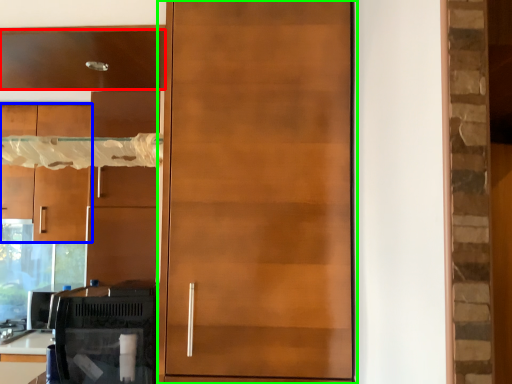
Question: Based on their relative distances, which object is farther from cabinetry (highlighted by a red box)? Choose from cabinetry (highlighted by a blue box) and door (highlighted by a green box).

Choices:
 (A) cabinetry
 (B) door

Answer: (A)